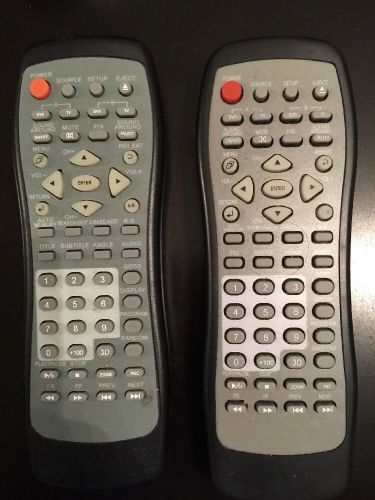
The width and height of the screenshot is (375, 500). I want to click on blank table space, so click(189, 39).